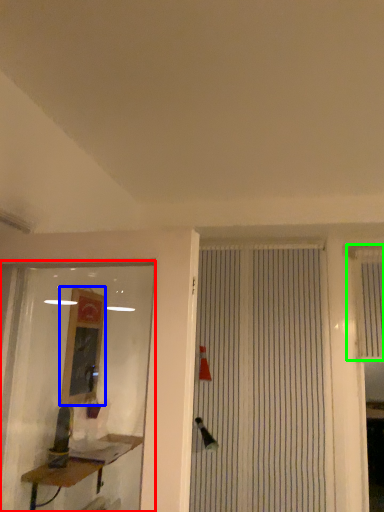
Question: Based on their relative distances, which object is nearer to shop window (highlighted by a red box)? Choose from job (highlighted by a blue box) and shutter (highlighted by a green box).

Choices:
 (A) job
 (B) shutter

Answer: (A)